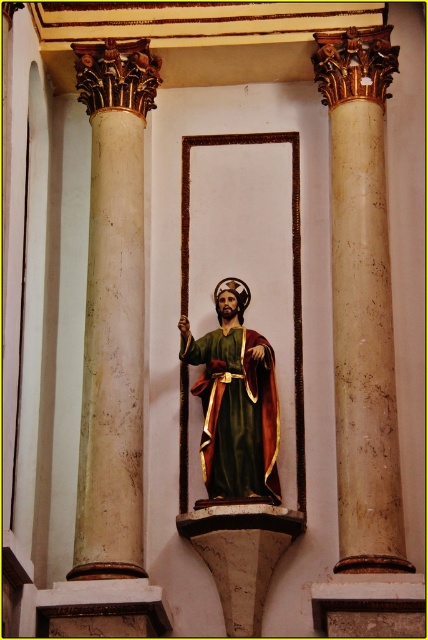
You are an architect planning to install a new lighting fixture between the beige marble column at left and the green velvet robe at center. The fixture requires a minimum of 10 meters of space between the two objects to be installed safely. Based on the scene description, is the current distance sufficient for installation?

The beige marble column at left and green velvet robe at center are 9.56 meters apart, which is less than the required 10 meters. Therefore, the distance is insufficient for safe installation of the lighting fixture.

You are standing in front of the religious statue between two columns. There is a point marked at coordinates [362,300]. Which column is this point located on?

The point at coordinates [362,300] is located on the beige marble column at right.

You are an interior designer planning to install a new lighting fixture in the niche. The fixture requires a mounting point that is at least 2 meters tall. Given the beige marble column at right and the green velvet robe at center, which object can provide a suitable mounting location?

The beige marble column at right is much taller than the green velvet robe at center, so the beige marble column at right can provide a suitable mounting location for the lighting fixture as it meets the height requirement of at least 2 meters.